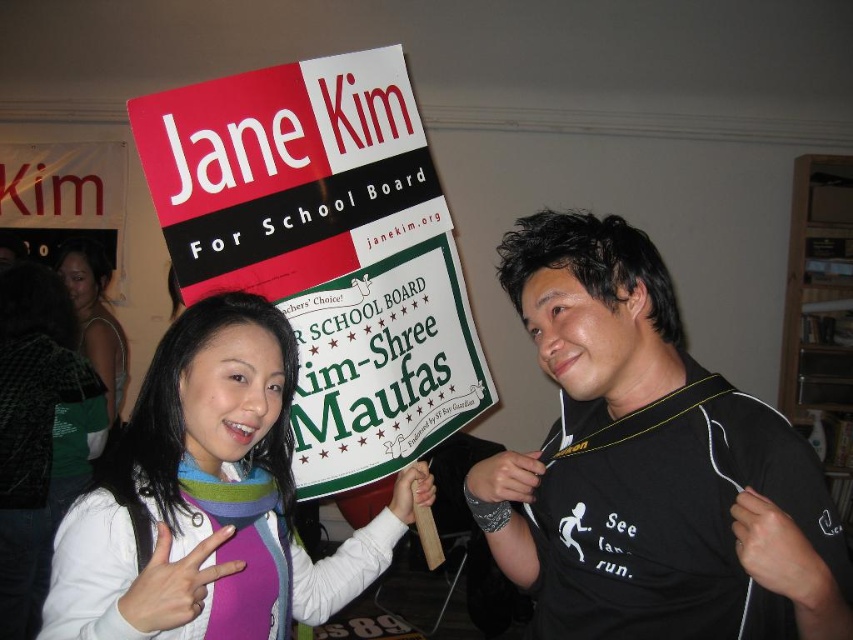
Does multicolored scarf at center appear on the left side of matte green dress at center?

Incorrect, multicolored scarf at center is not on the left side of matte green dress at center.

Measure the distance between multicolored scarf at center and camera.

multicolored scarf at center is 30.31 inches away from camera.

Where is `multicolored scarf at center`? This screenshot has height=640, width=853. multicolored scarf at center is located at coordinates (209, 499).

In the scene shown: Is black matte shirt at center to the right of red plastic sign at upper center from the viewer's perspective?

Indeed, black matte shirt at center is positioned on the right side of red plastic sign at upper center.

Is point (798, 605) positioned behind point (178, 234)?

No, it is not.

I want to click on black matte shirt at center, so click(x=650, y=465).

Who is lower down, red plastic sign at upper center or matte green dress at center?

matte green dress at center is below.

In the scene shown: Is red plastic sign at upper center positioned before matte green dress at center?

That is True.

What are the coordinates of `red plastic sign at upper center` in the screenshot? It's located at (325, 250).

Find the location of a particular element. red plastic sign at upper center is located at coordinates (325, 250).